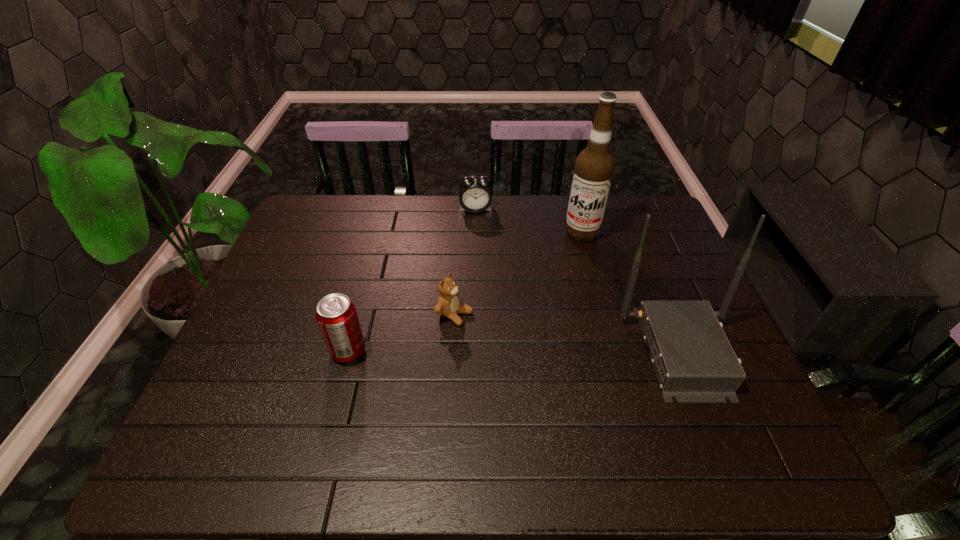
The height and width of the screenshot is (540, 960). Find the location of `vacant area between the leftmost object and the farthest object`. vacant area between the leftmost object and the farthest object is located at coordinates (412, 280).

Identify the location of unoccupied position between the soda and the fourth shortest object. (515, 352).

Where is `vacant area between the leftmost object and the tallest object`? vacant area between the leftmost object and the tallest object is located at coordinates (465, 292).

You are a GUI agent. You are given a task and a screenshot of the screen. Output one action in this format:
    pyautogui.click(x=<x>, y=<y>)
    Task: Click on the vacant area that lies between the alarm clock and the second tallest object
    This screenshot has width=960, height=540.
    Given the screenshot: What is the action you would take?
    pyautogui.click(x=578, y=280)

You are a GUI agent. You are given a task and a screenshot of the screen. Output one action in this format:
    pyautogui.click(x=<x>, y=<y>)
    Task: Click on the vacant region between the fourth nearest object and the teddy bear
    The image size is (960, 540).
    Given the screenshot: What is the action you would take?
    pyautogui.click(x=518, y=273)

Locate an element on the screen. The image size is (960, 540). free spot between the farthest object and the third shortest object is located at coordinates (412, 280).

Locate an element on the screen. The image size is (960, 540). vacant area between the alarm clock and the third tallest object is located at coordinates (412, 280).

You are a GUI agent. You are given a task and a screenshot of the screen. Output one action in this format:
    pyautogui.click(x=<x>, y=<y>)
    Task: Click on the object that ranks as the third closest to the alarm clock
    The height and width of the screenshot is (540, 960).
    Given the screenshot: What is the action you would take?
    pyautogui.click(x=693, y=360)

Find the location of a particular element. object that ranks as the closest to the second tallest object is located at coordinates (594, 167).

At what (x,y) coordinates should I click in order to perform the action: click on free space that satisfies the following two spatial constraints: 1. on the front side of the farthest object; 2. on the back of the router to connect cables. Please return your answer as a coordinate pair (x, y). The image size is (960, 540). Looking at the image, I should click on (473, 352).